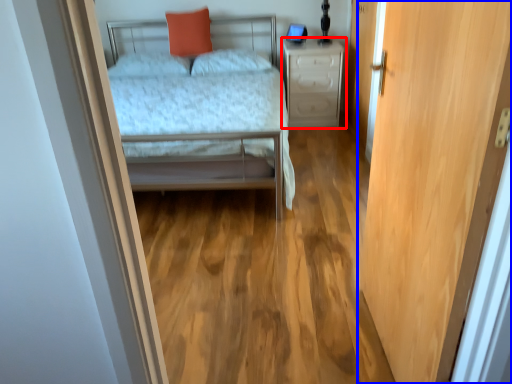
Question: Which point is closer to the camera, nightstand (highlighted by a red box) or door (highlighted by a blue box)?

Choices:
 (A) nightstand
 (B) door

Answer: (B)